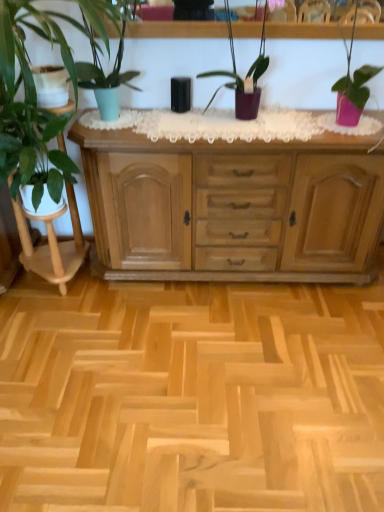
Question: In terms of height, does matte green pot at left, the fourth houseplant from the right, look taller or shorter compared to natural wood cabinet at center?

Choices:
 (A) tall
 (B) short

Answer: (B)

Question: Which is correct: matte green pot at left, marked as the first houseplant in a left-to-right arrangement, is inside natural wood cabinet at center, or outside of it?

Choices:
 (A) outside
 (B) inside

Answer: (A)

Question: Estimate the real-world distances between objects in this image. Which object is farther from the white glossy plant stand at left?

Choices:
 (A) matte green pot at upper left, which appears as the second houseplant when viewed from the left
 (B) matte green pot at left, the fourth houseplant from the right
 (C) purple matte plant at center, the 2th houseplant in the right-to-left sequence
 (D) pink matte pot at right, the 1th houseplant viewed from the right
 (E) natural wood cabinet at center

Answer: (D)

Question: Based on their relative distances, which object is nearer to the pink matte pot at right, which is counted as the 4th houseplant, starting from the left?

Choices:
 (A) white glossy plant stand at left
 (B) matte green pot at left, marked as the first houseplant in a left-to-right arrangement
 (C) natural wood cabinet at center
 (D) purple matte plant at center, the 2th houseplant in the right-to-left sequence
 (E) matte green pot at upper left, which appears as the second houseplant when viewed from the left

Answer: (D)